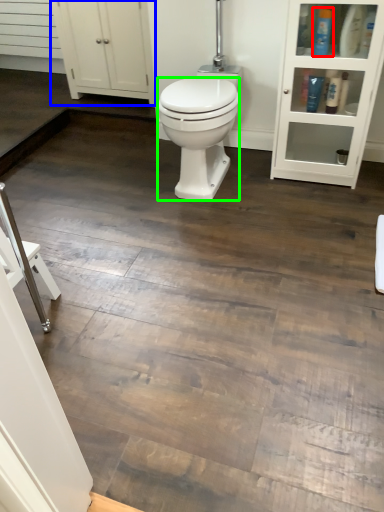
Question: Which object is the closest to the toiletry (highlighted by a red box)? Choose among these: cabinetry (highlighted by a blue box) or bidet (highlighted by a green box).

Choices:
 (A) cabinetry
 (B) bidet

Answer: (B)